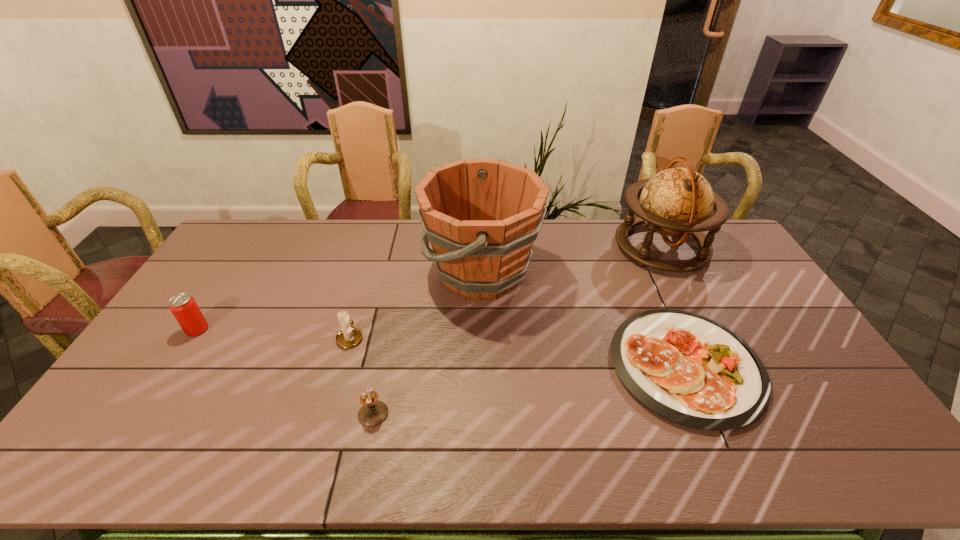
Locate an element on the screen. Image resolution: width=960 pixels, height=540 pixels. free region located on the handle side of the bucket is located at coordinates (308, 273).

Where is `free region located 0.070m on the handle side of the bucket`? free region located 0.070m on the handle side of the bucket is located at coordinates (403, 273).

Where is `free space located on the right of the leftmost object`? free space located on the right of the leftmost object is located at coordinates (248, 329).

I want to click on vacant space located on the handle side of the farther candle holder, so click(x=362, y=299).

At what (x,y) coordinates should I click in order to perform the action: click on free location located 0.310m on the handle side of the farther candle holder. Please return your answer as a coordinate pair (x, y). The image size is (960, 540). Looking at the image, I should click on (372, 262).

Locate an element on the screen. This screenshot has height=540, width=960. free location located 0.340m on the handle side of the farther candle holder is located at coordinates (373, 256).

Locate an element on the screen. This screenshot has width=960, height=540. vacant region located 0.310m on the left of the fourth object from right to left is located at coordinates (236, 414).

At what (x,y) coordinates should I click in order to perform the action: click on blank space located on the back of the dish. Please return your answer as a coordinate pair (x, y). Looking at the image, I should click on (642, 266).

Where is `globe present at the far edge`? globe present at the far edge is located at coordinates tap(676, 202).

The height and width of the screenshot is (540, 960). I want to click on bucket that is at the far edge, so click(481, 216).